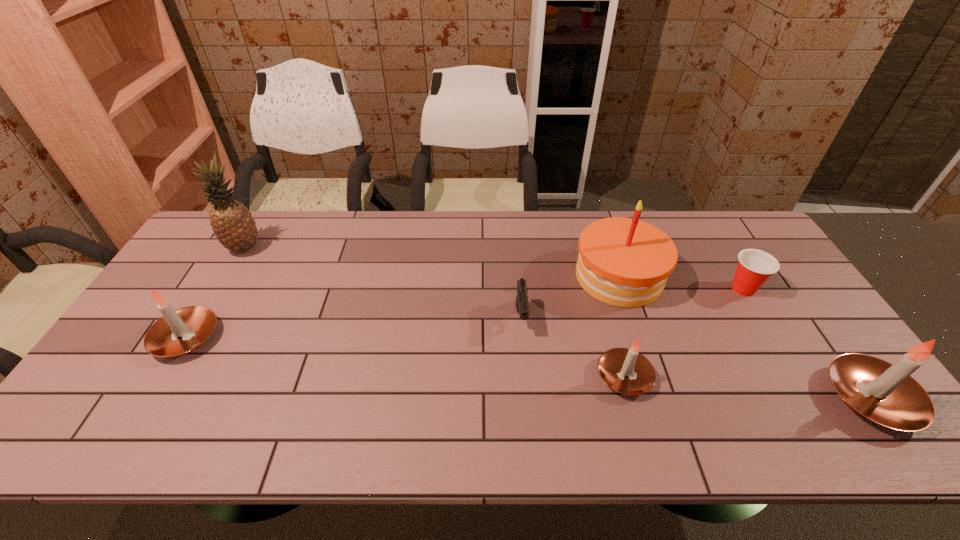
Please mark a free spot for a new candle to balance the arrangement. Please provide its 2D coordinates. Your answer should be formatted as a tuple, i.e. [(x, y)], where the tuple contains the x and y coordinates of a point satisfying the conditions above.

[(396, 356)]